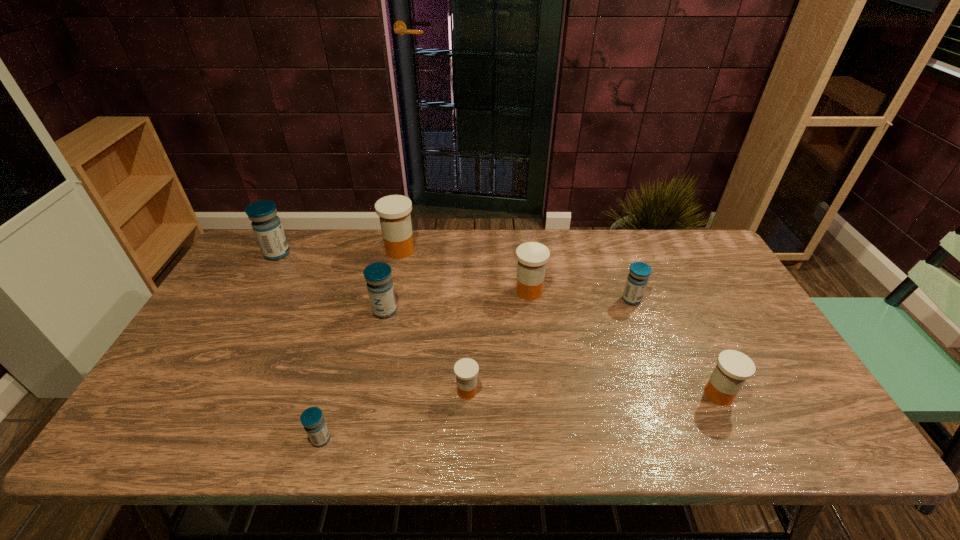
Choose which orange medicine is the third nearest neighbor to the rightmost object. Please provide its 2D coordinates. Your answer should be formatted as a tuple, i.e. [(x, y)], where the tuple contains the x and y coordinates of a point satisfying the conditions above.

[(394, 211)]

Where is `free spot that satisfies the following two spatial constraints: 1. on the label of the biggest orange medicine; 2. on the front side of the third blue medicine from left to right`? The height and width of the screenshot is (540, 960). free spot that satisfies the following two spatial constraints: 1. on the label of the biggest orange medicine; 2. on the front side of the third blue medicine from left to right is located at coordinates (386, 310).

At what (x,y) coordinates should I click in order to perform the action: click on free space that satisfies the following two spatial constraints: 1. on the label of the third biggest blue medicine; 2. on the right side of the farthest orange medicine. Please return your answer as a coordinate pair (x, y). The width and height of the screenshot is (960, 540). Looking at the image, I should click on (389, 300).

I want to click on vacant point that satisfies the following two spatial constraints: 1. on the label of the third medicine from right to left; 2. on the left side of the seventh medicine from left to right, so click(x=530, y=300).

Locate an element on the screen. Image resolution: width=960 pixels, height=540 pixels. free location that satisfies the following two spatial constraints: 1. on the back side of the second medicine from right to left; 2. on the label of the biggest orange medicine is located at coordinates (613, 250).

Locate an element on the screen. vacant space that satisfies the following two spatial constraints: 1. on the back side of the second smallest blue medicine; 2. on the label of the leftmost orange medicine is located at coordinates (613, 250).

Where is `free spot that satisfies the following two spatial constraints: 1. on the label of the leftmost orange medicine; 2. on the front side of the biggest blue medicine`? free spot that satisfies the following two spatial constraints: 1. on the label of the leftmost orange medicine; 2. on the front side of the biggest blue medicine is located at coordinates (399, 254).